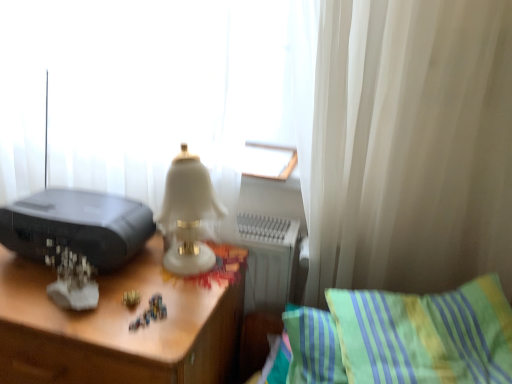
Locate an element on the screen. The width and height of the screenshot is (512, 384). white sheer curtain at upper left is located at coordinates (138, 90).

What do you see at coordinates (77, 226) in the screenshot? I see `black plastic printer at left` at bounding box center [77, 226].

You are a GUI agent. You are given a task and a screenshot of the screen. Output one action in this format:
    pyautogui.click(x=<x>, y=<y>)
    Task: Click on the white sheer curtain at upper left
    The height and width of the screenshot is (384, 512).
    Given the screenshot: What is the action you would take?
    pyautogui.click(x=138, y=90)

Is green striped pillow at lower right oriented away from black plastic printer at left?

green striped pillow at lower right is not turned away from black plastic printer at left.

Does green striped pillow at lower right have a smaller size compared to black plastic printer at left?

Actually, green striped pillow at lower right might be larger than black plastic printer at left.

Considering the points (499, 363) and (64, 239), which point is behind, point (499, 363) or point (64, 239)?

The point (64, 239) is farther from the camera.

Is green striped pillow at lower right taller than black plastic printer at left?

Correct, green striped pillow at lower right is much taller as black plastic printer at left.

Is white sheer curtain at upper left next to black plastic printer at left?

white sheer curtain at upper left is not next to black plastic printer at left, and they're not touching.

Based on the photo, between white sheer curtain at upper left and black plastic printer at left, which one has less height?

With less height is black plastic printer at left.

Considering the positions of objects white sheer curtain at upper left and black plastic printer at left in the image provided, who is more to the left, white sheer curtain at upper left or black plastic printer at left?

From the viewer's perspective, white sheer curtain at upper left appears more on the left side.

Considering the relative sizes of white sheer curtain at upper left and black plastic printer at left in the image provided, is white sheer curtain at upper left bigger than black plastic printer at left?

Indeed, white sheer curtain at upper left has a larger size compared to black plastic printer at left.

Is wooden desk at center inside black plastic printer at left?

No, wooden desk at center is not inside black plastic printer at left.

Based on the photo, how much distance is there between black plastic printer at left and wooden desk at center?

black plastic printer at left is 5.50 inches away from wooden desk at center.

Considering the positions of points (39, 235) and (54, 277), is point (39, 235) farther from camera compared to point (54, 277)?

Yes, point (39, 235) is behind point (54, 277).

Is black plastic printer at left next to wooden desk at center?

They are not placed beside each other.

Which is more to the left, white sheer curtain at upper left or green striped pillow at lower right?

white sheer curtain at upper left.

Is white sheer curtain at upper left directly adjacent to green striped pillow at lower right?

No, white sheer curtain at upper left is not making contact with green striped pillow at lower right.

Is white sheer curtain at upper left wider than green striped pillow at lower right?

No, white sheer curtain at upper left is not wider than green striped pillow at lower right.

In order to click on pillow that is on the right side of white sheer curtain at upper left in this screenshot , I will do `click(425, 334)`.

Is point (87, 238) farther from viewer compared to point (408, 306)?

That is True.

Can you confirm if black plastic printer at left is positioned to the left of green striped pillow at lower right?

Yes.

Is black plastic printer at left aimed at green striped pillow at lower right?

No, black plastic printer at left does not turn towards green striped pillow at lower right.

From a real-world perspective, is black plastic printer at left physically located above or below green striped pillow at lower right?

black plastic printer at left is situated higher than green striped pillow at lower right in the real world.

Is green striped pillow at lower right spatially inside white sheer curtain at upper left, or outside of it?

green striped pillow at lower right exists outside the volume of white sheer curtain at upper left.

Is green striped pillow at lower right positioned with its back to white sheer curtain at upper left?

No, green striped pillow at lower right is not facing the opposite direction of white sheer curtain at upper left.

What's the angular difference between green striped pillow at lower right and white sheer curtain at upper left's facing directions?

The angular difference between green striped pillow at lower right and white sheer curtain at upper left is 22.3 degrees.

Can you confirm if wooden desk at center is shorter than black plastic printer at left?

Incorrect, the height of wooden desk at center does not fall short of that of black plastic printer at left.

What's the angular difference between wooden desk at center and black plastic printer at left's facing directions?

1.49 degrees.

Measure the distance between wooden desk at center and black plastic printer at left.

wooden desk at center and black plastic printer at left are 5.50 inches apart.

In the image, is wooden desk at center positioned in front of or behind black plastic printer at left?

wooden desk at center is in front of black plastic printer at left.

At what (x,y) coordinates should I click in order to perform the action: click on pillow that appears below the black plastic printer at left (from a real-world perspective). Please return your answer as a coordinate pair (x, y). The width and height of the screenshot is (512, 384). Looking at the image, I should click on (425, 334).

You are a GUI agent. You are given a task and a screenshot of the screen. Output one action in this format:
    pyautogui.click(x=<x>, y=<y>)
    Task: Click on the curtain on the left side of black plastic printer at left
    
    Given the screenshot: What is the action you would take?
    pyautogui.click(x=138, y=90)

Estimate the real-world distances between objects in this image. Which object is further from black plastic printer at left, wooden desk at center or white sheer curtain at upper left?

white sheer curtain at upper left is positioned further to the anchor black plastic printer at left.

Which object lies nearer to the anchor point wooden desk at center, green striped pillow at lower right or white sheer curtain at upper left?

The object closer to wooden desk at center is white sheer curtain at upper left.

Which object lies nearer to the anchor point wooden desk at center, white sheer curtain at upper left or green striped pillow at lower right?

white sheer curtain at upper left is positioned closer to the anchor wooden desk at center.

Based on their spatial positions, is wooden desk at center or green striped pillow at lower right further from white sheer curtain at upper left?

green striped pillow at lower right lies further to white sheer curtain at upper left than the other object.

Based on their spatial positions, is green striped pillow at lower right or wooden desk at center further from white sheer curtain at upper left?

green striped pillow at lower right lies further to white sheer curtain at upper left than the other object.

From the image, which object appears to be farther from black plastic printer at left, white sheer curtain at upper left or green striped pillow at lower right?

green striped pillow at lower right is positioned further to the anchor black plastic printer at left.

Based on their spatial positions, is white sheer curtain at upper left or wooden desk at center closer to black plastic printer at left?

wooden desk at center is closer to black plastic printer at left.

From the picture: From the image, which object appears to be nearer to wooden desk at center, white sheer curtain at upper left or black plastic printer at left?

black plastic printer at left is positioned closer to the anchor wooden desk at center.

Where is `printer located between white sheer curtain at upper left and green striped pillow at lower right in the left-right direction`? The height and width of the screenshot is (384, 512). printer located between white sheer curtain at upper left and green striped pillow at lower right in the left-right direction is located at coordinates (77, 226).

I want to click on desk between black plastic printer at left and green striped pillow at lower right, so click(x=121, y=325).

Locate an element on the screen. The image size is (512, 384). printer between white sheer curtain at upper left and wooden desk at center vertically is located at coordinates (77, 226).

What are the coordinates of `desk located between white sheer curtain at upper left and green striped pillow at lower right in the left-right direction` in the screenshot? It's located at (121, 325).